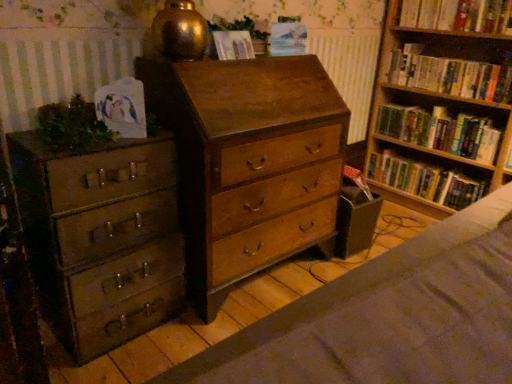
Measure the distance between hardcover book at upper right, which ranks as the first book in top-to-bottom order, and camera.

The depth of hardcover book at upper right, which ranks as the first book in top-to-bottom order, is 2.08 meters.

What do you see at coordinates (458, 15) in the screenshot? I see `hardcover book at upper right, the fourth book in the bottom-to-top sequence` at bounding box center [458, 15].

What do you see at coordinates (102, 237) in the screenshot? I see `matte green metal chest of drawers at left, the 2th chest of drawers when ordered from right to left` at bounding box center [102, 237].

What are the coordinates of `green leafy plant at upper center, the first plant viewed from the right` in the screenshot? It's located at (238, 27).

Describe the element at coordinates (425, 180) in the screenshot. I see `hardcover book at right, the fourth book viewed from the top` at that location.

What is the approximate width of matte paper at upper center, which appears as the second paperback book when viewed from the front?

The width of matte paper at upper center, which appears as the second paperback book when viewed from the front, is 3.53 inches.

Where is `wooden bookshelf at right, the 2th book in the bottom-to-top sequence`? Image resolution: width=512 pixels, height=384 pixels. wooden bookshelf at right, the 2th book in the bottom-to-top sequence is located at coordinates (441, 131).

Does hardcover books at right, marked as the third book in a bottom-to-top arrangement, lie in front of hardcover book at upper right, which ranks as the first book in top-to-bottom order?

No.

Which object is positioned more to the left, hardcover books at right, marked as the third book in a bottom-to-top arrangement, or hardcover book at upper right, the fourth book in the bottom-to-top sequence?

hardcover book at upper right, the fourth book in the bottom-to-top sequence, is more to the left.

Starting from the hardcover book at upper right, which ranks as the first book in top-to-bottom order, which book is the 1st one behind? Please provide its 2D coordinates.

[(450, 75)]

Which is in front, point (408, 80) or point (490, 6)?

Point (490, 6)

Considering the relative sizes of green matte plant at left, positioned as the 1th plant in front-to-back order, and matte green metal chest of drawers at left, the 2th chest of drawers when ordered from right to left, in the image provided, is green matte plant at left, positioned as the 1th plant in front-to-back order, thinner than matte green metal chest of drawers at left, the 2th chest of drawers when ordered from right to left,?

Yes.

Which is more to the right, green matte plant at left, the second plant in the right-to-left sequence, or matte green metal chest of drawers at left, the 2th chest of drawers when ordered from right to left?

From the viewer's perspective, matte green metal chest of drawers at left, the 2th chest of drawers when ordered from right to left, appears more on the right side.

From the image's perspective, which is below, green matte plant at left, positioned as the 1th plant in front-to-back order, or matte green metal chest of drawers at left, the 1th chest of drawers in the left-to-right sequence?

matte green metal chest of drawers at left, the 1th chest of drawers in the left-to-right sequence, is shown below in the image.

Looking at their sizes, would you say wooden bookshelf at right, which ranks as the third book in top-to-bottom order, is wider or thinner than hardcover books at right, which is the second book in top-to-bottom order?

In the image, wooden bookshelf at right, which ranks as the third book in top-to-bottom order, appears to be more narrow than hardcover books at right, which is the second book in top-to-bottom order.

Is wooden bookshelf at right, which ranks as the third book in top-to-bottom order, taller than hardcover books at right, which is the second book in top-to-bottom order?

No, wooden bookshelf at right, which ranks as the third book in top-to-bottom order, is not taller than hardcover books at right, which is the second book in top-to-bottom order.

Is wooden bookshelf at right, which ranks as the third book in top-to-bottom order, turned away from hardcover books at right, marked as the third book in a bottom-to-top arrangement?

No, hardcover books at right, marked as the third book in a bottom-to-top arrangement, is not at the back of wooden bookshelf at right, which ranks as the third book in top-to-bottom order.

Does wooden bookshelf at right, the 2th book in the bottom-to-top sequence, lie behind hardcover books at right, which is the second book in top-to-bottom order?

Yes, it is.

Considering the relative positions of matte paper at upper center, placed as the 1th paperback book when sorted from back to front, and wooden bookshelf at right, which ranks as the third book in top-to-bottom order, in the image provided, is matte paper at upper center, placed as the 1th paperback book when sorted from back to front, to the left of wooden bookshelf at right, which ranks as the third book in top-to-bottom order, from the viewer's perspective?

Yes.

How many degrees apart are the facing directions of matte paper at upper center, which appears as the second paperback book when viewed from the front, and wooden bookshelf at right, the 2th book in the bottom-to-top sequence?

matte paper at upper center, which appears as the second paperback book when viewed from the front, and wooden bookshelf at right, the 2th book in the bottom-to-top sequence, are facing 77.8 degrees away from each other.

Is matte paper at upper center, which appears as the second paperback book when viewed from the front, wider or thinner than wooden bookshelf at right, which ranks as the third book in top-to-bottom order?

matte paper at upper center, which appears as the second paperback book when viewed from the front, is thinner than wooden bookshelf at right, which ranks as the third book in top-to-bottom order.

Does hardcover books at right, marked as the third book in a bottom-to-top arrangement, appear on the left side of matte green metal chest of drawers at left, the 2th chest of drawers when ordered from right to left?

Answer: No.

Does point (434, 90) come farther from viewer compared to point (102, 332)?

Yes, point (434, 90) is behind point (102, 332).

Does hardcover books at right, which is the second book in top-to-bottom order, have a larger size compared to matte green metal chest of drawers at left, the 2th chest of drawers when ordered from right to left?

Incorrect, hardcover books at right, which is the second book in top-to-bottom order, is not larger than matte green metal chest of drawers at left, the 2th chest of drawers when ordered from right to left.

Is hardcover books at right, marked as the third book in a bottom-to-top arrangement, next to matte green metal chest of drawers at left, the 2th chest of drawers when ordered from right to left?

No, hardcover books at right, marked as the third book in a bottom-to-top arrangement, is not with matte green metal chest of drawers at left, the 2th chest of drawers when ordered from right to left.

Is hardcover book at upper right, which ranks as the first book in top-to-bottom order, positioned in front of hardcover books at right, which is the second book in top-to-bottom order?

That is True.

Is hardcover book at upper right, which ranks as the first book in top-to-bottom order, far away from hardcover books at right, which is the second book in top-to-bottom order?

No, hardcover book at upper right, which ranks as the first book in top-to-bottom order, is in close proximity to hardcover books at right, which is the second book in top-to-bottom order.

Which of these two, hardcover book at upper right, the fourth book in the bottom-to-top sequence, or hardcover books at right, marked as the third book in a bottom-to-top arrangement, is thinner?

hardcover books at right, marked as the third book in a bottom-to-top arrangement.

Between hardcover book at upper right, which ranks as the first book in top-to-bottom order, and hardcover books at right, marked as the third book in a bottom-to-top arrangement, which one has larger size?

With larger size is hardcover books at right, marked as the third book in a bottom-to-top arrangement.

Considering the positions of objects matte paper at upper center, marked as the 2th paperback book in a left-to-right arrangement, and matte paper at center, which ranks as the 1th paperback book in left-to-right order, in the image provided, who is behind, matte paper at upper center, marked as the 2th paperback book in a left-to-right arrangement, or matte paper at center, which ranks as the 1th paperback book in left-to-right order,?

matte paper at upper center, marked as the 2th paperback book in a left-to-right arrangement, is further away from the camera.

Consider the image. Is matte paper at upper center, marked as the 2th paperback book in a left-to-right arrangement, situated inside matte paper at center, which ranks as the second paperback book in right-to-left order, or outside?

matte paper at upper center, marked as the 2th paperback book in a left-to-right arrangement, cannot be found inside matte paper at center, which ranks as the second paperback book in right-to-left order.

From a real-world perspective, is matte paper at upper center, placed as the 1th paperback book when sorted from back to front, below matte paper at center, arranged as the 2th paperback book when viewed from the back?

Actually, matte paper at upper center, placed as the 1th paperback book when sorted from back to front, is physically above matte paper at center, arranged as the 2th paperback book when viewed from the back, in the real world.

Where is `book lying above the hardcover books at right, which is the second book in top-to-bottom order (from the image's perspective)`? book lying above the hardcover books at right, which is the second book in top-to-bottom order (from the image's perspective) is located at coordinates (458, 15).

Where is `the 2nd chest of drawers positioned below the green matte plant at left, arranged as the second plant when viewed from the back (from a real-world perspective)`? Image resolution: width=512 pixels, height=384 pixels. the 2nd chest of drawers positioned below the green matte plant at left, arranged as the second plant when viewed from the back (from a real-world perspective) is located at coordinates (102, 237).

When comparing their distances from matte paper at center, arranged as the 2th paperback book when viewed from the back, does matte paper at upper center, marked as the 2th paperback book in a left-to-right arrangement, or hardcover book at right, the fourth book viewed from the top, seem further?

Based on the image, hardcover book at right, the fourth book viewed from the top, appears to be further to matte paper at center, arranged as the 2th paperback book when viewed from the back.

Estimate the real-world distances between objects in this image. Which object is closer to wooden bookshelf at right, the 2th book in the bottom-to-top sequence, green leafy plant at upper center, which is the second plant from bottom to top, or matte green metal chest of drawers at left, the 1th chest of drawers in the left-to-right sequence?

green leafy plant at upper center, which is the second plant from bottom to top.

Which object lies nearer to the anchor point matte paper at upper center, which appears as the second paperback book when viewed from the front, wooden chest of drawers at center, acting as the second chest of drawers starting from the left, or green matte plant at left, arranged as the second plant when viewed from the back?

wooden chest of drawers at center, acting as the second chest of drawers starting from the left.

Looking at the image, which one is located further to wooden bookshelf at right, the 2th book in the bottom-to-top sequence, matte green metal chest of drawers at left, the 2th chest of drawers when ordered from right to left, or matte paper at upper center, which appears as the second paperback book when viewed from the front?

matte green metal chest of drawers at left, the 2th chest of drawers when ordered from right to left, is positioned further to the anchor wooden bookshelf at right, the 2th book in the bottom-to-top sequence.

Estimate the real-world distances between objects in this image. Which object is further from green leafy plant at upper center, marked as the first plant in a back-to-front arrangement, hardcover book at upper right, the fourth book in the bottom-to-top sequence, or wooden bookshelf at right, the 2th book in the bottom-to-top sequence?

wooden bookshelf at right, the 2th book in the bottom-to-top sequence, is positioned further to the anchor green leafy plant at upper center, marked as the first plant in a back-to-front arrangement.

Considering their positions, is matte green metal chest of drawers at left, the 1th chest of drawers in the left-to-right sequence, positioned further to wooden chest of drawers at center, the first chest of drawers when ordered from right to left, than matte paper at center, arranged as the 2th paperback book when viewed from the back?

matte paper at center, arranged as the 2th paperback book when viewed from the back, is positioned further to the anchor wooden chest of drawers at center, the first chest of drawers when ordered from right to left.

Estimate the real-world distances between objects in this image. Which object is closer to green matte plant at left, the second plant in the right-to-left sequence, hardcover books at right, marked as the third book in a bottom-to-top arrangement, or wooden chest of drawers at center, acting as the second chest of drawers starting from the left?

The object closer to green matte plant at left, the second plant in the right-to-left sequence, is wooden chest of drawers at center, acting as the second chest of drawers starting from the left.

When comparing their distances from green matte plant at left, marked as the 1th plant in a left-to-right arrangement, does hardcover book at right, the fourth book viewed from the top, or wooden chest of drawers at center, the first chest of drawers when ordered from right to left, seem closer?

The object closer to green matte plant at left, marked as the 1th plant in a left-to-right arrangement, is wooden chest of drawers at center, the first chest of drawers when ordered from right to left.

This screenshot has height=384, width=512. I want to click on paperback book between wooden chest of drawers at center, the first chest of drawers when ordered from right to left, and hardcover book at upper right, the fourth book in the bottom-to-top sequence, so coord(288,39).

Where is `paperback book that lies between matte paper at upper center, placed as the 1th paperback book when sorted from back to front, and wooden chest of drawers at center, the first chest of drawers when ordered from right to left, from top to bottom`? Image resolution: width=512 pixels, height=384 pixels. paperback book that lies between matte paper at upper center, placed as the 1th paperback book when sorted from back to front, and wooden chest of drawers at center, the first chest of drawers when ordered from right to left, from top to bottom is located at coordinates (233, 45).

Locate an element on the screen. Image resolution: width=512 pixels, height=384 pixels. paperback book situated between matte paper at center, which ranks as the second paperback book in right-to-left order, and wooden bookshelf at right, the 2th book in the bottom-to-top sequence, from left to right is located at coordinates (288, 39).

The height and width of the screenshot is (384, 512). Find the location of `paperback book situated between matte paper at center, arranged as the 2th paperback book when viewed from the back, and hardcover book at upper right, the fourth book in the bottom-to-top sequence, from left to right`. paperback book situated between matte paper at center, arranged as the 2th paperback book when viewed from the back, and hardcover book at upper right, the fourth book in the bottom-to-top sequence, from left to right is located at coordinates (288, 39).